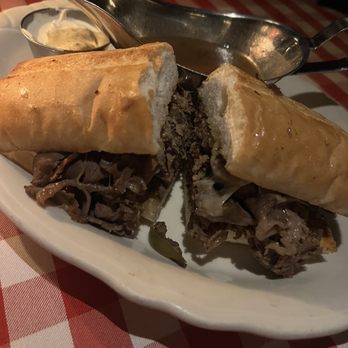
Find the location of `metal sauce container`. metal sauce container is located at coordinates (38, 51).